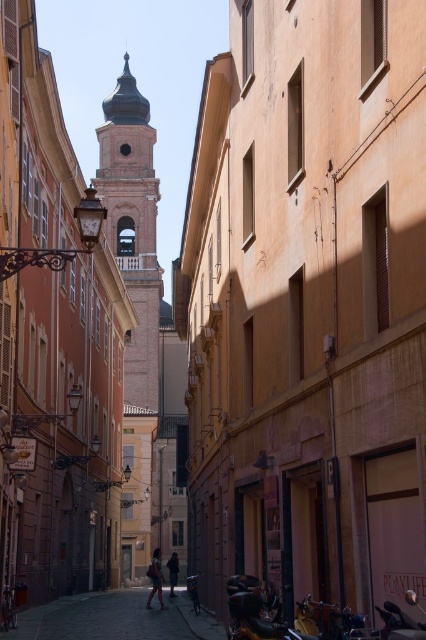
Is smooth beige bell tower at center to the right of smooth cobblestone alley at center from the viewer's perspective?

In fact, smooth beige bell tower at center is to the left of smooth cobblestone alley at center.

Between point (146, 224) and point (14, 637), which one is positioned behind?

Positioned behind is point (146, 224).

The width and height of the screenshot is (426, 640). In order to click on smooth beige bell tower at center in this screenshot , I will do `click(132, 227)`.

Can you confirm if smooth cobblestone alley at center is thinner than dark gray fabric jacket at center?

No.

Is smooth cobblestone alley at center to the right of dark gray fabric jacket at center from the viewer's perspective?

Incorrect, smooth cobblestone alley at center is not on the right side of dark gray fabric jacket at center.

What do you see at coordinates (112, 620) in the screenshot? I see `smooth cobblestone alley at center` at bounding box center [112, 620].

You are a GUI agent. You are given a task and a screenshot of the screen. Output one action in this format:
    pyautogui.click(x=<x>, y=<y>)
    Task: Click on the smooth cobblestone alley at center
    This screenshot has height=640, width=426.
    Given the screenshot: What is the action you would take?
    pyautogui.click(x=112, y=620)

Can you confirm if dark gray fabric jacket at center is taller than dark brown leather jacket at center?

Incorrect, dark gray fabric jacket at center's height is not larger of dark brown leather jacket at center's.

How much distance is there between dark gray fabric jacket at center and dark brown leather jacket at center?

dark gray fabric jacket at center and dark brown leather jacket at center are 9.62 meters apart from each other.

I want to click on dark gray fabric jacket at center, so click(155, 579).

The width and height of the screenshot is (426, 640). What are the coordinates of `dark gray fabric jacket at center` in the screenshot? It's located at click(x=155, y=579).